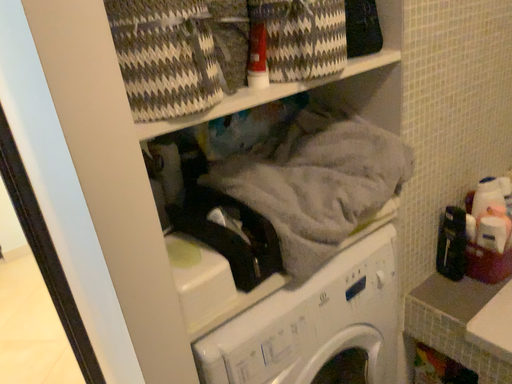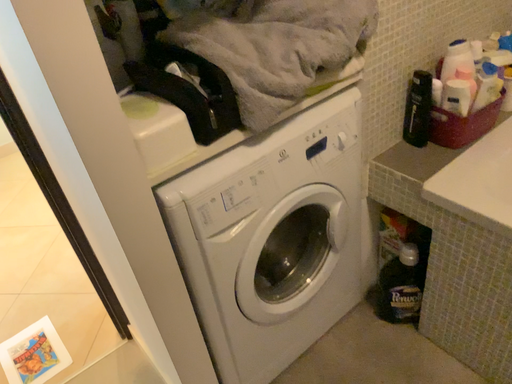
Question: Which way did the camera rotate in the video?

Choices:
 (A) rotated upward
 (B) rotated downward

Answer: (B)